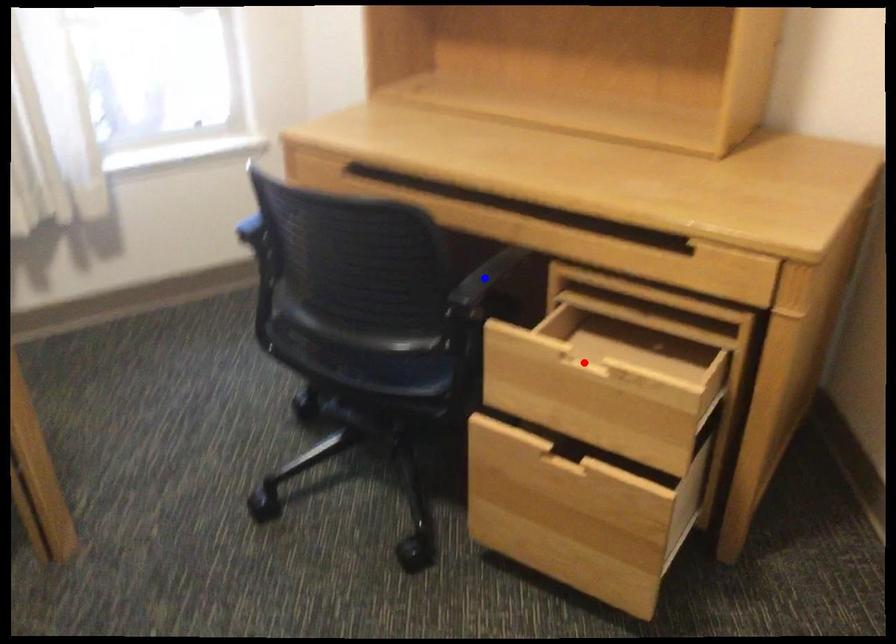
Question: In the image, two points are highlighted. Which point is nearer to the camera? Reply with the corresponding letter.

Choices:
 (A) blue point
 (B) red point

Answer: (B)